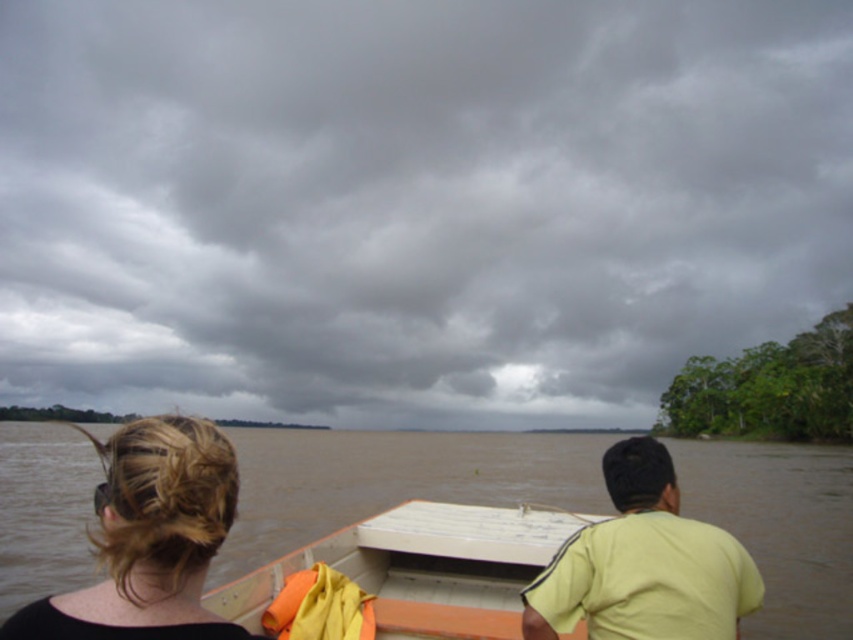
Question: Can you confirm if blonde hair at lower left is positioned to the left of white matte boat at center?

Choices:
 (A) no
 (B) yes

Answer: (B)

Question: Which point is closer to the camera?

Choices:
 (A) light green t-shirt at center
 (B) white matte boat at center
 (C) brown muddy water at center
 (D) blonde hair at lower left

Answer: (D)

Question: Among these objects, which one is nearest to the camera?

Choices:
 (A) white matte boat at center
 (B) blonde hair at lower left
 (C) light green t-shirt at center
 (D) brown muddy water at center

Answer: (B)

Question: Is brown muddy water at center positioned in front of blonde hair at lower left?

Choices:
 (A) yes
 (B) no

Answer: (B)

Question: Does brown muddy water at center lie in front of white matte boat at center?

Choices:
 (A) no
 (B) yes

Answer: (A)

Question: Among these points, which one is nearest to the camera?

Choices:
 (A) (9, 444)
 (B) (656, 483)
 (C) (131, 602)

Answer: (C)